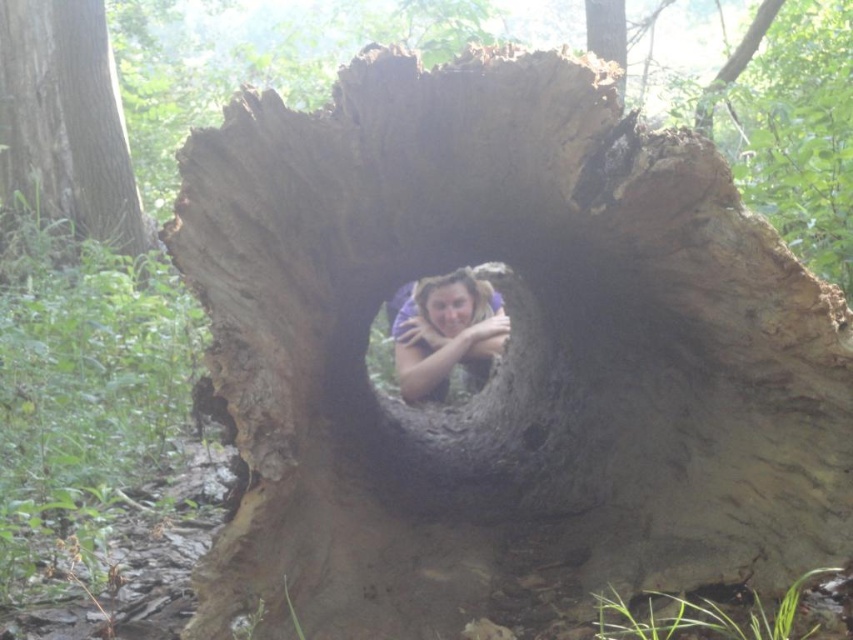
Does smooth brown tree trunk at center appear on the right side of matte purple shirt at center?

Incorrect, smooth brown tree trunk at center is not on the right side of matte purple shirt at center.

Does smooth brown tree trunk at center come behind matte purple shirt at center?

Yes, smooth brown tree trunk at center is further from the viewer.

Describe the element at coordinates (67, 122) in the screenshot. I see `smooth brown tree trunk at center` at that location.

Where is `smooth brown tree trunk at center`? The image size is (853, 640). smooth brown tree trunk at center is located at coordinates (67, 122).